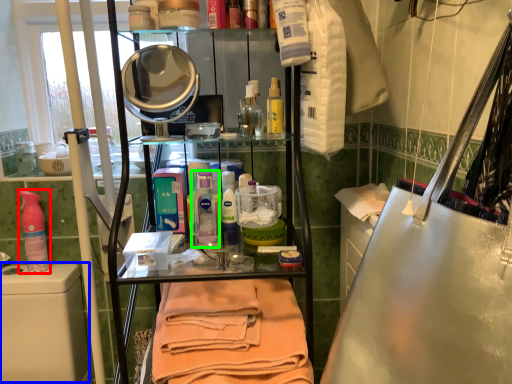
Question: Which is farther away from cleaning product (highlighted by a red box)? washing (highlighted by a blue box) or cleaning product (highlighted by a green box)?

Choices:
 (A) washing
 (B) cleaning product

Answer: (B)